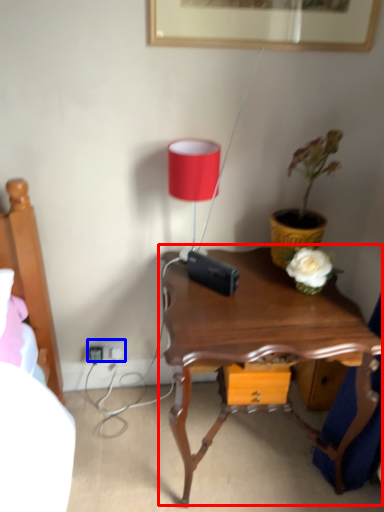
Question: Which point is closer to the camera, nightstand (highlighted by a red box) or electric outlet (highlighted by a blue box)?

Choices:
 (A) nightstand
 (B) electric outlet

Answer: (A)